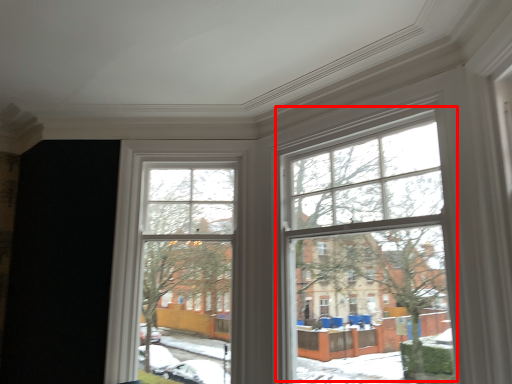
Question: From the image's perspective, where is bay window (annotated by the red box) located in relation to bay window in the image?

Choices:
 (A) above
 (B) below

Answer: (A)